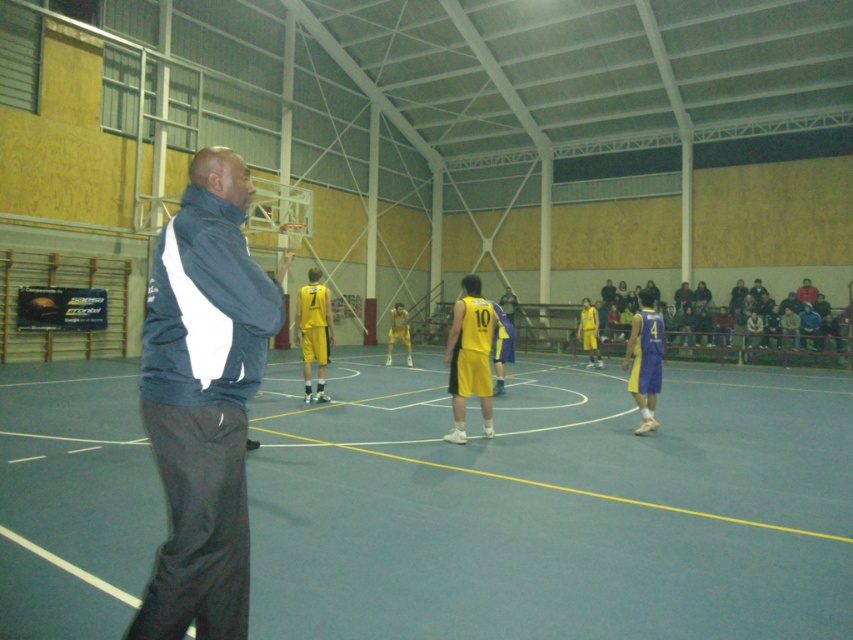
You are a spectator sitting in the bleachers and want to take a photo of both the blue jersey at center and yellow jersey at center. Which jersey will appear larger in your photo?

The blue jersey at center will appear larger in the photo because it is closer to the viewer than the yellow jersey at center.

Based on the scene description, where is the yellow matte basketball player at center located in terms of coordinates?

The yellow matte basketball player at center is located at coordinates approximately 0.559 on the x axis and 0.552 on the y axis.